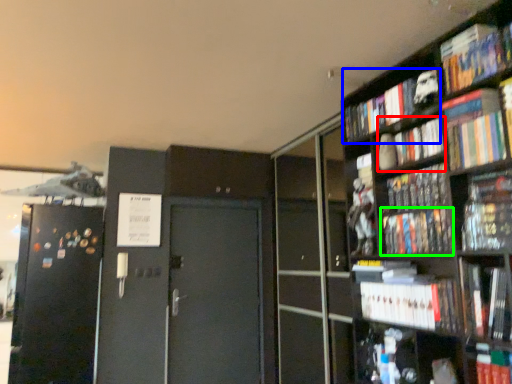
Question: Which object is the closest to the book (highlighted by a red box)? Choose among these: book (highlighted by a blue box) or book (highlighted by a green box).

Choices:
 (A) book
 (B) book

Answer: (A)